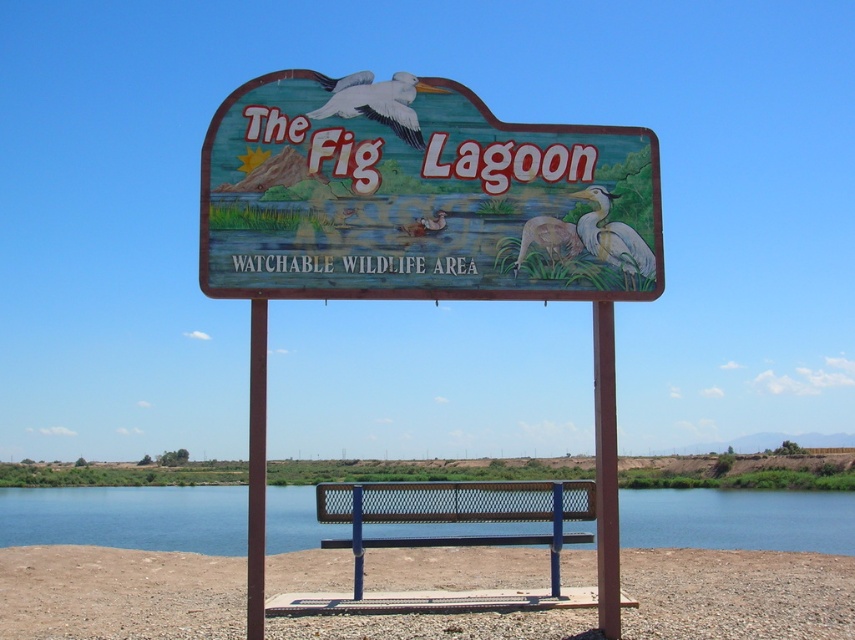
Looking at this image, you are standing in front of the signboard for The Fig Lagoon. There is a wooden sign at center. Where is the wooden sign located relative to the point with coordinates point (x=419, y=196)?

The wooden sign at center is located exactly at point (x=419, y=196).

You are a visitor at The Fig Lagoon and want to sit on the metal mesh bench at center while reading the wooden sign at center. Is the bench currently blocking your view of the sign?

The wooden sign at center is in front of the metal mesh bench at center, so the bench is not blocking your view of the sign.

You are a visitor at The Fig Lagoon and want to take a photo of both the wooden sign at center and the blue water at bench center. Which object should you focus on first to ensure both are in the frame without moving the camera?

You should focus on the wooden sign at center first because it is smaller than the blue water at bench center, so centering the smaller object first allows both to fit within the camera frame.